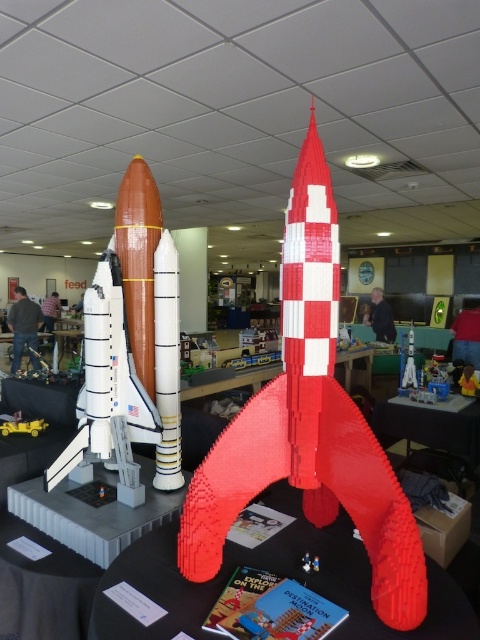
You are a visitor at the LEGO exhibition and want to take a photo of both the black plastic table at center and the matte plastic rocket at center. Since you want to include both in the frame, do you need to adjust your camera angle to account for their heights?

The black plastic table at center is much taller than the matte plastic rocket at center, so you will need to lower your camera angle to ensure both are visible in the frame.

You are a visitor at the LEGO exhibition and want to take a photo of both the yellow plastic toy car at center and the matte plastic rocket at center in the same frame. The camera you have can capture objects within a 4 meter range. Can you fit both objects in the frame without moving the camera?

The yellow plastic toy car at center and the matte plastic rocket at center are 3.28 meters apart. Since the camera can capture objects within a 4 meter range, both objects can be included in the same frame without moving the camera.

You are an event organizer who needs to place a 3D model of a satellite that is 1.2 meters in height onto the black plastic table at center or the matte plastic rocket at center. Based on the size of the objects, which surface can accommodate the satellite model without it overhanging the edges?

The black plastic table at center is bigger than the matte plastic rocket at center, so the satellite model should be placed on the black plastic table at center to ensure it fits without overhanging.